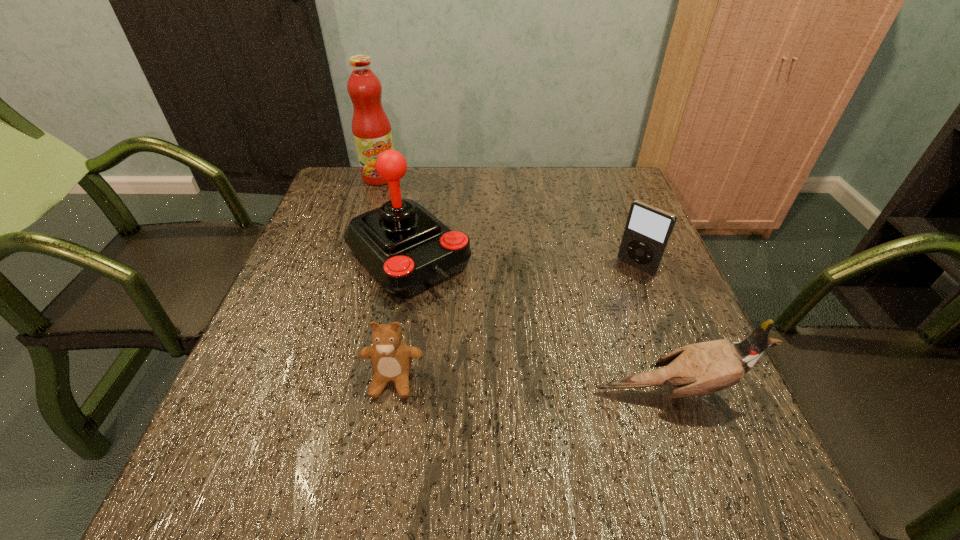
At what (x,y) coordinates should I click in order to perform the action: click on teddy bear. Please return your answer as a coordinate pair (x, y). This screenshot has height=540, width=960. Looking at the image, I should click on (391, 358).

Where is `bird`? Image resolution: width=960 pixels, height=540 pixels. bird is located at coordinates (697, 369).

Where is `iPod`? This screenshot has height=540, width=960. iPod is located at coordinates (648, 229).

Image resolution: width=960 pixels, height=540 pixels. In order to click on fruit juice in this screenshot , I will do pyautogui.click(x=371, y=128).

This screenshot has width=960, height=540. I want to click on the farthest object, so click(x=371, y=128).

Where is `joystick`? joystick is located at coordinates (409, 250).

Find the location of a particular element. free spot located on the front-facing side of the teddy bear is located at coordinates (385, 427).

The height and width of the screenshot is (540, 960). I want to click on blank space located on the front-facing side of the iPod, so click(554, 350).

The height and width of the screenshot is (540, 960). Find the location of `vacant region located on the front-facing side of the iPod`. vacant region located on the front-facing side of the iPod is located at coordinates (589, 314).

I want to click on free space located 0.200m on the front-facing side of the iPod, so click(582, 322).